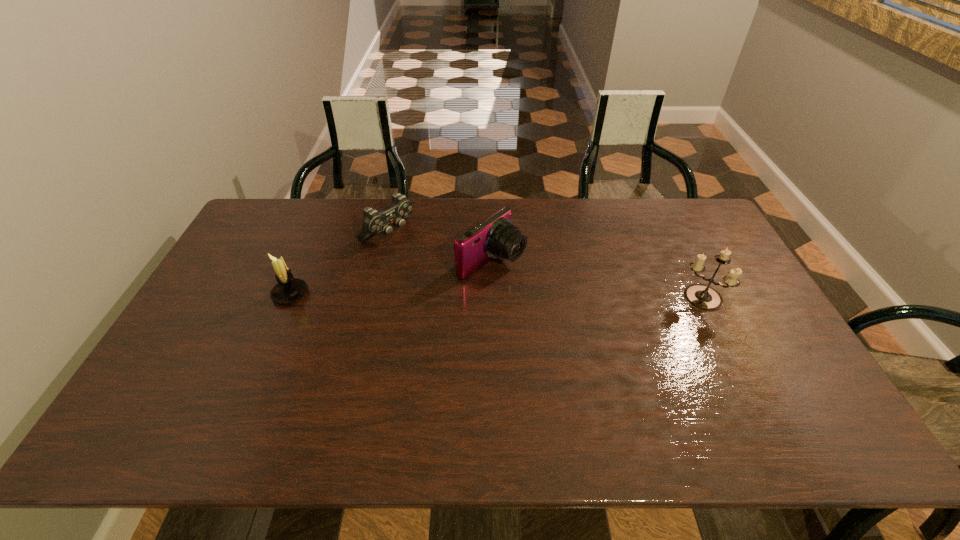
In order to click on free space on the desktop that is between the leftmost object and the rightmost object and is positioned on the surface of the third object from right to left with buttons in this screenshot , I will do `click(480, 296)`.

Locate an element on the screen. free space on the desktop that is between the leftmost object and the rightmost object and is positioned on the front-facing side of the camera is located at coordinates (549, 296).